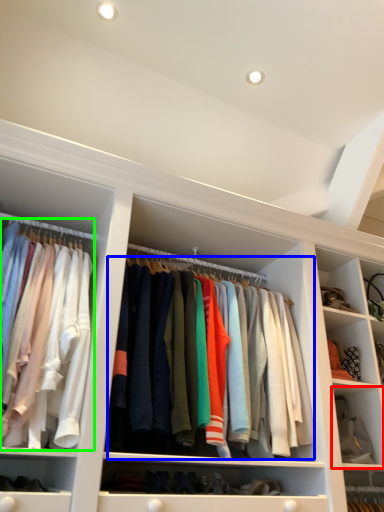
Question: Considering the real-world distances, which object is closest to cabinet (highlighted by a red box)? clothing (highlighted by a blue box) or clothing (highlighted by a green box).

Choices:
 (A) clothing
 (B) clothing

Answer: (A)